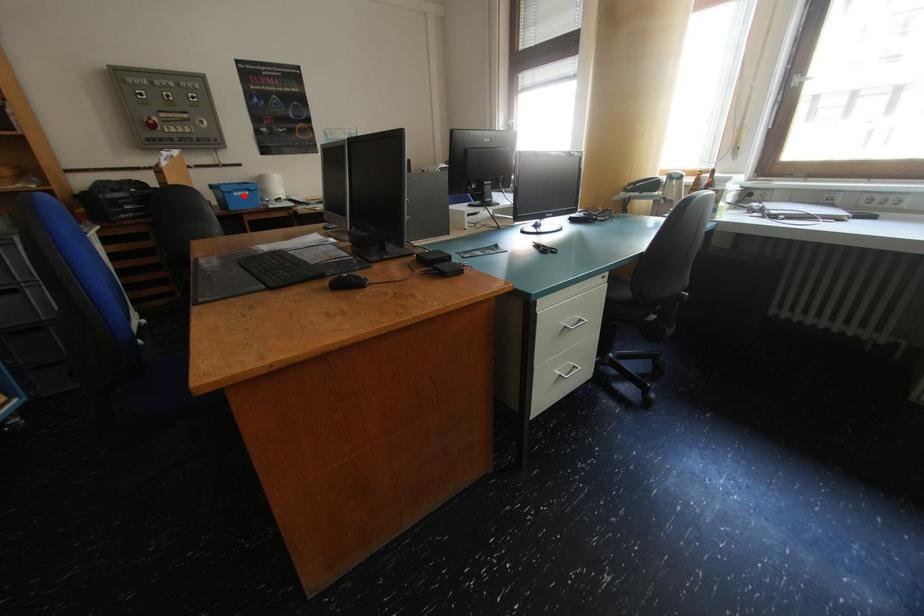
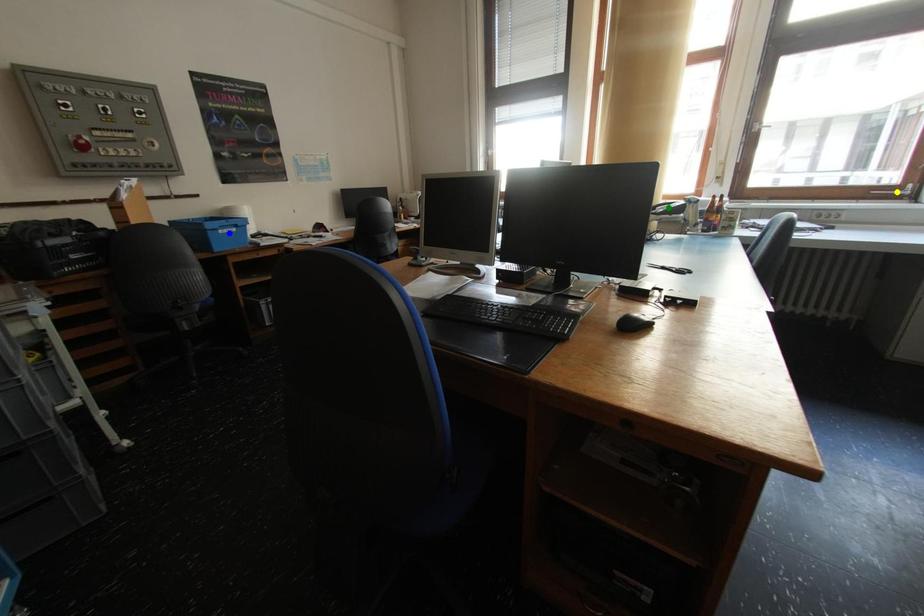
Question: I am providing you with two images of the same scene from different viewpoints. A red point is marked on the first image. You are given multiple points on the second image. Which mark in image 2 goes with the point in image 1?

Choices:
 (A) green point
 (B) yellow point
 (C) blue point

Answer: (C)